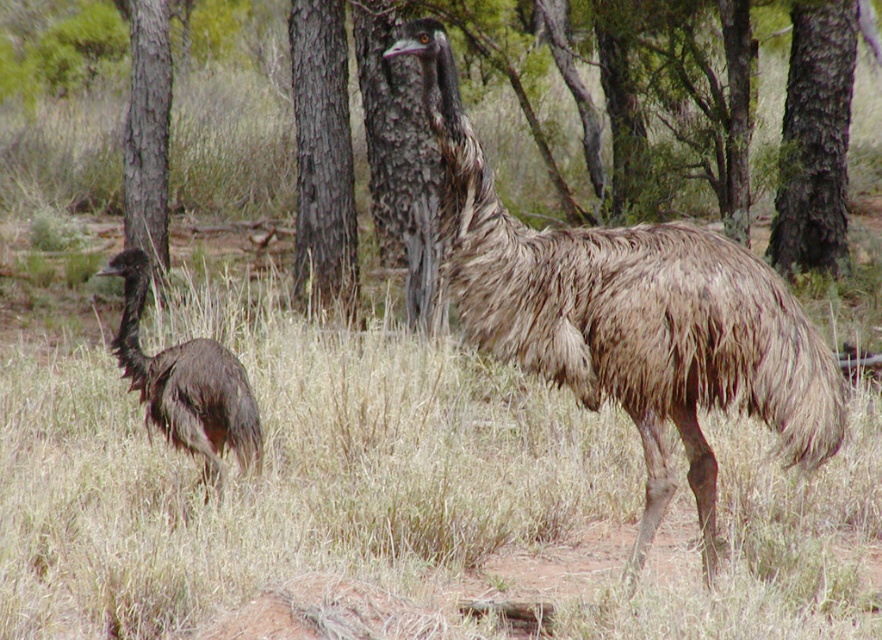
Does brown textured grass at center have a larger size compared to brown feathered ostrich at left?

Correct, brown textured grass at center is larger in size than brown feathered ostrich at left.

Can you confirm if brown textured grass at center is positioned below brown feathered ostrich at left?

Indeed, brown textured grass at center is positioned under brown feathered ostrich at left.

Between point (255, 385) and point (233, 360), which one is positioned behind?

Point (255, 385)

Identify the location of brown textured grass at center. (283, 476).

Is brown textured grass at center to the right of brown rough bark tree at upper right from the viewer's perspective?

Incorrect, brown textured grass at center is not on the right side of brown rough bark tree at upper right.

Which is below, brown textured grass at center or brown rough bark tree at upper right?

brown textured grass at center is below.

Who is more distant from viewer, (476, 557) or (842, 264)?

Point (842, 264)

What are the coordinates of `brown textured grass at center` in the screenshot? It's located at (283, 476).

Does point (809, 504) come closer to viewer compared to point (333, 13)?

That is True.

Which is more to the right, brown textured grass at center or brown rough bark tree at center?

Positioned to the right is brown textured grass at center.

Does point (253, 316) come in front of point (297, 26)?

Yes, point (253, 316) is closer to viewer.

Identify the location of brown textured grass at center. (283, 476).